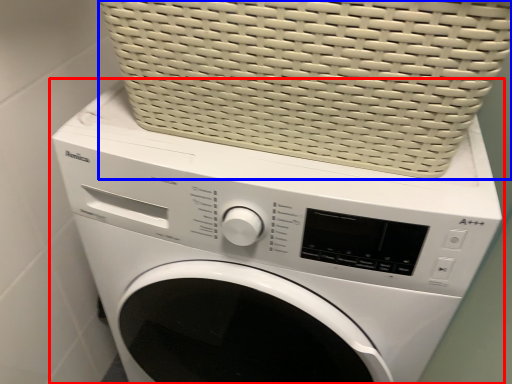
Question: Which of the following is the farthest to the observer, washing machine (highlighted by a red box) or basket (highlighted by a blue box)?

Choices:
 (A) washing machine
 (B) basket

Answer: (A)